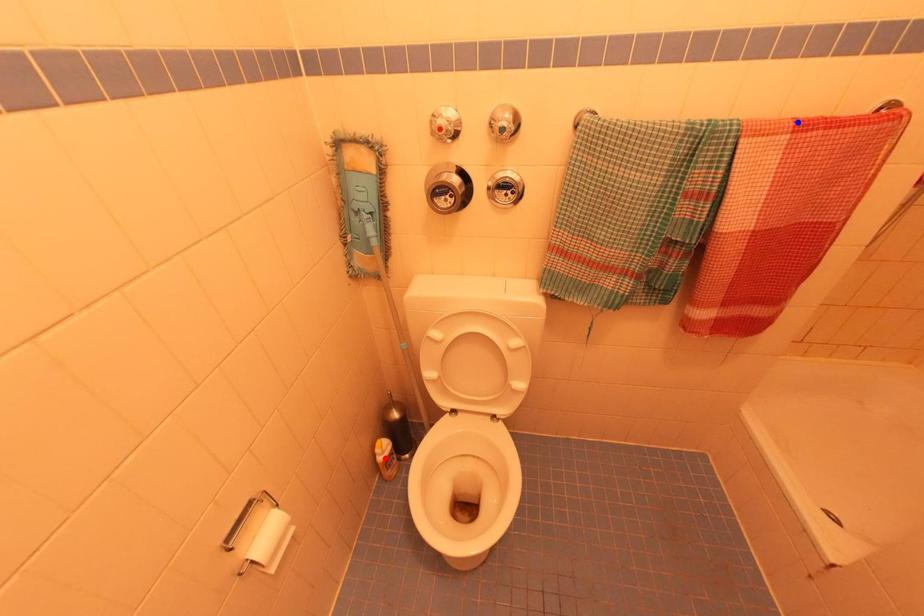
Question: In the image, two points are highlighted. Which point is nearer to the camera? Reply with the corresponding letter.

Choices:
 (A) blue point
 (B) red point

Answer: (A)